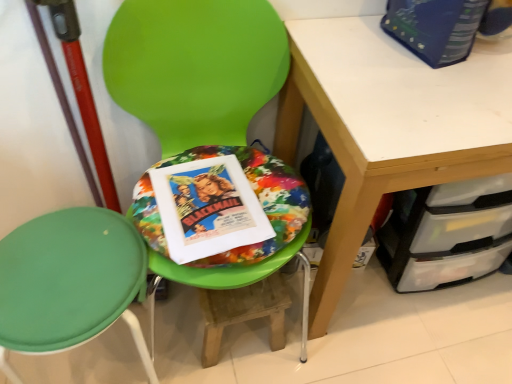
Find the location of `vacant space to the right of wooden step stool at center`. vacant space to the right of wooden step stool at center is located at coordinates (315, 339).